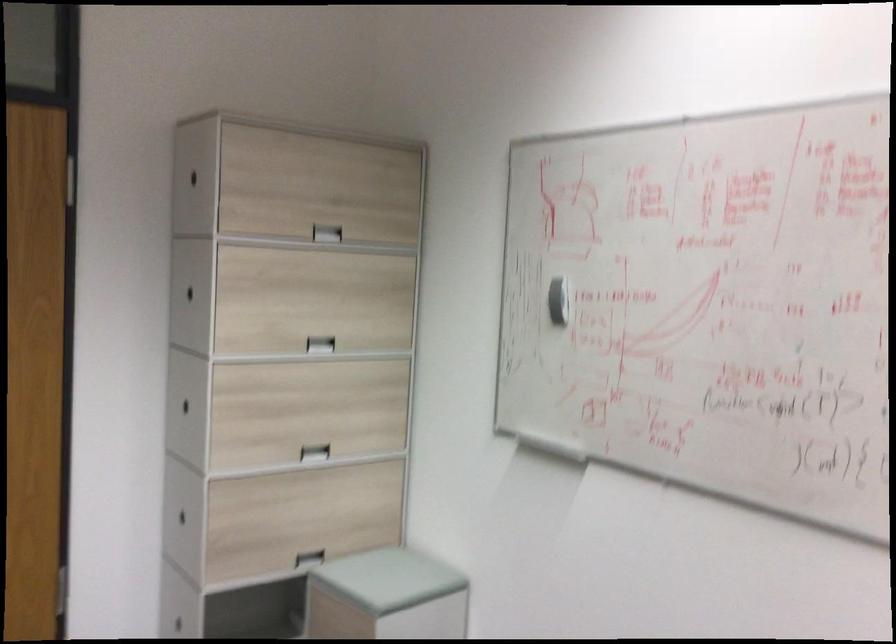
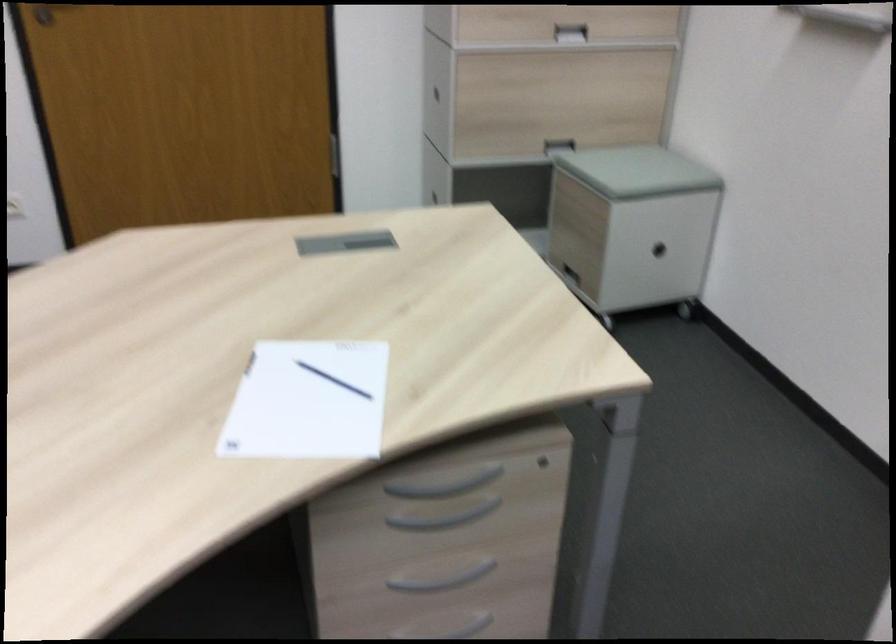
Locate, in the second image, the point that corresponds to (x=307, y=561) in the first image.

(557, 146)